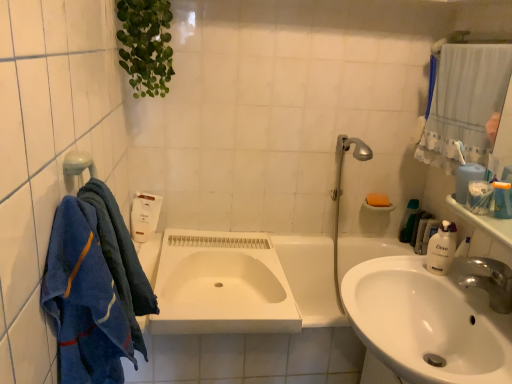
Question: Is blue terry cloth towel at left, the second bath towel when ordered from front to back, aimed at blue cotton towel at left, marked as the second bath towel in a back-to-front arrangement?

Choices:
 (A) yes
 (B) no

Answer: (B)

Question: From the image's perspective, is blue terry cloth towel at left, the second bath towel when ordered from front to back, on top of blue cotton towel at left, acting as the 1th bath towel starting from the front?

Choices:
 (A) yes
 (B) no

Answer: (A)

Question: Does blue terry cloth towel at left, marked as the 1th bath towel in a back-to-front arrangement, have a smaller size compared to blue cotton towel at left, marked as the second bath towel in a back-to-front arrangement?

Choices:
 (A) yes
 (B) no

Answer: (A)

Question: Considering the relative positions of blue terry cloth towel at left, marked as the 1th bath towel in a back-to-front arrangement, and blue cotton towel at left, marked as the second bath towel in a back-to-front arrangement, in the image provided, is blue terry cloth towel at left, marked as the 1th bath towel in a back-to-front arrangement, behind blue cotton towel at left, marked as the second bath towel in a back-to-front arrangement,?

Choices:
 (A) no
 (B) yes

Answer: (B)

Question: From the image's perspective, is blue terry cloth towel at left, marked as the 1th bath towel in a back-to-front arrangement, beneath blue cotton towel at left, acting as the 1th bath towel starting from the front?

Choices:
 (A) no
 (B) yes

Answer: (A)

Question: Would you say green leafy plant at upper left is to the left or to the right of blue plastic container at upper right, which is the third toiletry from back to front, in the picture?

Choices:
 (A) right
 (B) left

Answer: (B)

Question: Is green leafy plant at upper left in front of or behind blue plastic container at upper right, which is the third toiletry from back to front, in the image?

Choices:
 (A) behind
 (B) front

Answer: (A)

Question: From a real-world perspective, is green leafy plant at upper left above or below blue plastic container at upper right, which is the third toiletry from back to front?

Choices:
 (A) below
 (B) above

Answer: (B)

Question: Is green leafy plant at upper left wider or thinner than blue plastic container at upper right, the first toiletry when ordered from front to back?

Choices:
 (A) thin
 (B) wide

Answer: (B)

Question: Relative to orange sponge at upper right, is white glossy soap dispenser at right in front or behind?

Choices:
 (A) behind
 (B) front

Answer: (B)

Question: Is white glossy soap dispenser at right taller or shorter than orange sponge at upper right?

Choices:
 (A) short
 (B) tall

Answer: (B)

Question: Is point (451, 261) closer or farther from the camera than point (378, 195)?

Choices:
 (A) farther
 (B) closer

Answer: (B)

Question: Choose the correct answer: Is white glossy soap dispenser at right inside orange sponge at upper right or outside it?

Choices:
 (A) outside
 (B) inside

Answer: (A)

Question: Is white plastic soap dispenser at upper right, the 3th toiletry when ordered from left to right, wider or thinner than white glossy countertop at upper right?

Choices:
 (A) thin
 (B) wide

Answer: (A)

Question: From their relative heights in the image, would you say white plastic soap dispenser at upper right, the 3th toiletry when ordered from left to right, is taller or shorter than white glossy countertop at upper right?

Choices:
 (A) tall
 (B) short

Answer: (A)